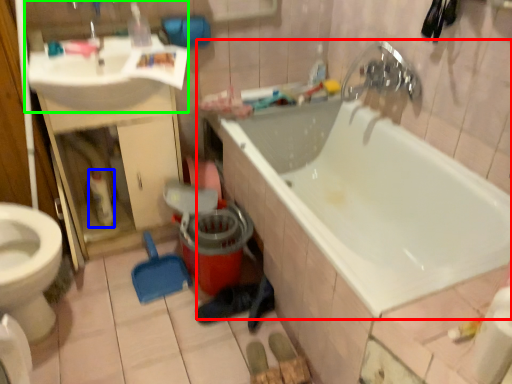
Question: Based on their relative distances, which object is farther from bathtub (highlighted by a red box)? Choose from cleaning product (highlighted by a blue box) and sink (highlighted by a green box).

Choices:
 (A) cleaning product
 (B) sink

Answer: (A)